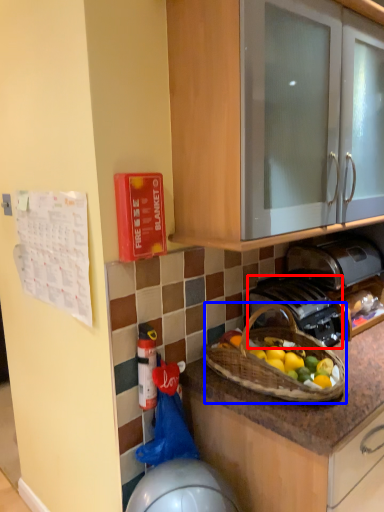
Question: Among these objects, which one is nearest to the camera, gas stove (highlighted by a red box) or picnic basket (highlighted by a blue box)?

Choices:
 (A) gas stove
 (B) picnic basket

Answer: (B)